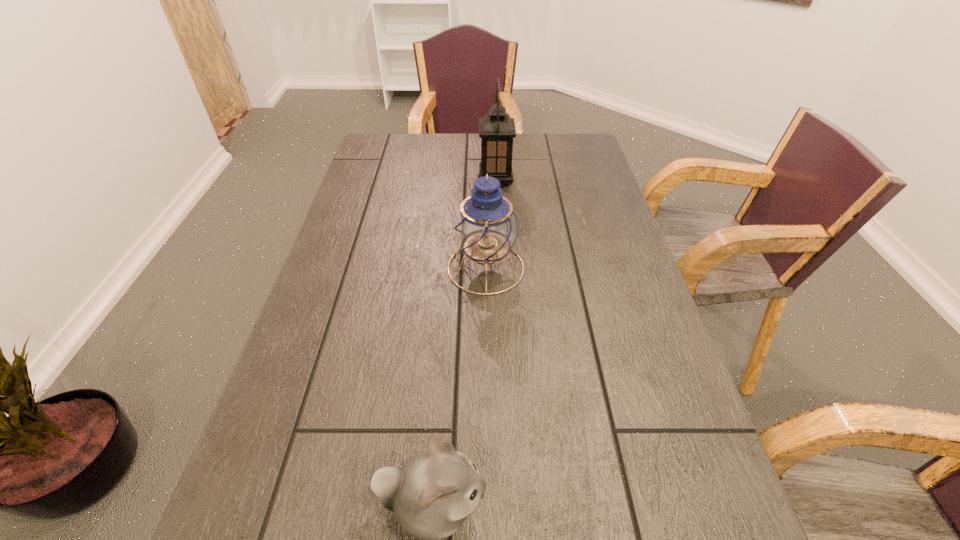
Find the location of a particular element. The image size is (960, 540). blank area at the right edge is located at coordinates (588, 191).

Image resolution: width=960 pixels, height=540 pixels. In the image, there is a desktop. Identify the location of vacant space at the far left corner. (380, 154).

Identify the location of vacant region at the far right corner of the desktop. The width and height of the screenshot is (960, 540). (587, 154).

Identify the location of object identified as the closest to the tallest object. (486, 227).

Identify which object is located as the nearest to the tallest object. Please provide its 2D coordinates. Your answer should be formatted as a tuple, i.e. [(x, y)], where the tuple contains the x and y coordinates of a point satisfying the conditions above.

[(486, 227)]